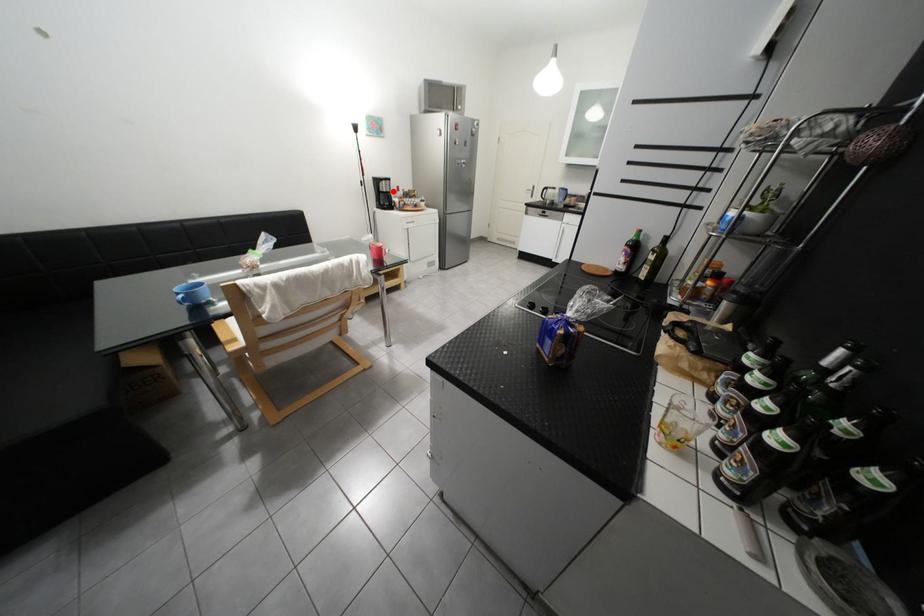
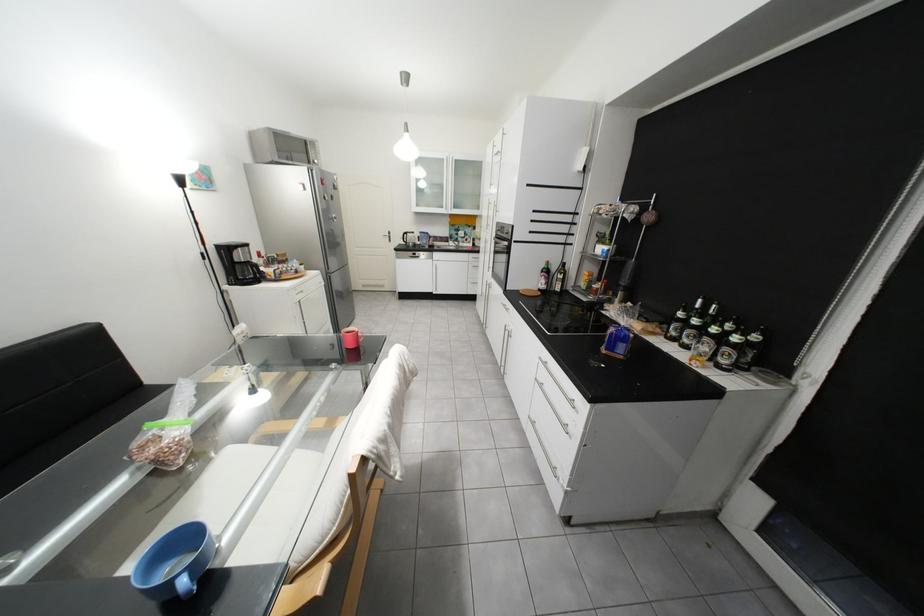
Where in the second image is the point corresponding to the highlighted location from the first image?

(249, 262)